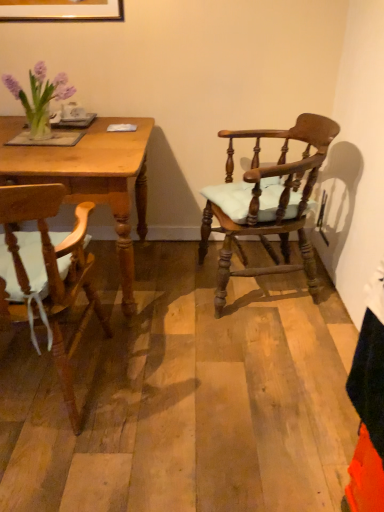
Question: Does point (64, 371) appear closer or farther from the camera than point (324, 147)?

Choices:
 (A) closer
 (B) farther

Answer: (A)

Question: Is wooden chair with cushion at left, which appears as the 1th chair when viewed from the left, wider or thinner than wooden chair with cushion at right, the 1th chair positioned from the right?

Choices:
 (A) thin
 (B) wide

Answer: (B)

Question: Which of these objects is positioned closest to the white ceramic mug at upper left?

Choices:
 (A) wooden chair with cushion at left, which is counted as the second chair, starting from the right
 (B) wooden table at left
 (C) wooden chair with cushion at right, placed as the second chair when sorted from left to right

Answer: (B)

Question: Considering the real-world distances, which object is farthest from the wooden chair with cushion at left, which appears as the 1th chair when viewed from the left?

Choices:
 (A) white ceramic mug at upper left
 (B) wooden table at left
 (C) wooden chair with cushion at right, placed as the second chair when sorted from left to right

Answer: (A)